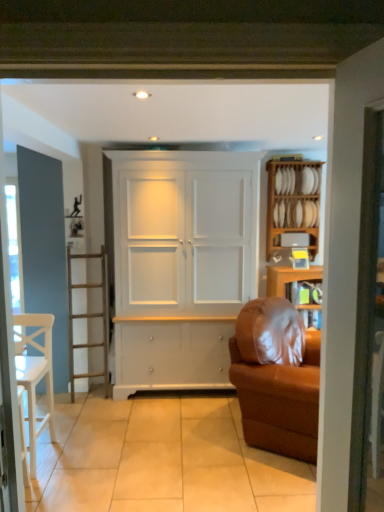
Question: From the image's perspective, is white matte cabinet at center on top of wooden plate rack at right, which is the second shelf from bottom to top?

Choices:
 (A) no
 (B) yes

Answer: (A)

Question: Is white matte cabinet at center next to wooden plate rack at right, which is the second shelf from bottom to top?

Choices:
 (A) yes
 (B) no

Answer: (B)

Question: Is the position of white matte cabinet at center less distant than that of wooden plate rack at right, which is the second shelf from bottom to top?

Choices:
 (A) yes
 (B) no

Answer: (A)

Question: Is white matte cabinet at center shorter than wooden plate rack at right, which is the second shelf from bottom to top?

Choices:
 (A) no
 (B) yes

Answer: (A)

Question: Considering the relative sizes of white matte cabinet at center and wooden plate rack at right, which is the 1th shelf from top to bottom, in the image provided, is white matte cabinet at center bigger than wooden plate rack at right, which is the 1th shelf from top to bottom,?

Choices:
 (A) no
 (B) yes

Answer: (B)

Question: Considering the positions of white wooden shelf at upper right, the first shelf when ordered from bottom to top, and brown fabric couch at right in the image, is white wooden shelf at upper right, the first shelf when ordered from bottom to top, wider or thinner than brown fabric couch at right?

Choices:
 (A) thin
 (B) wide

Answer: (A)

Question: In the image, is white wooden shelf at upper right, the first shelf when ordered from bottom to top, on the left side or the right side of brown fabric couch at right?

Choices:
 (A) left
 (B) right

Answer: (B)

Question: Do you think white wooden shelf at upper right, the first shelf when ordered from bottom to top, is within brown fabric couch at right, or outside of it?

Choices:
 (A) inside
 (B) outside

Answer: (B)

Question: Is point (289, 240) closer or farther from the camera than point (268, 393)?

Choices:
 (A) farther
 (B) closer

Answer: (A)

Question: From a real-world perspective, relative to white wooden shelf at upper right, the first shelf when ordered from bottom to top, is white matte cabinet at center vertically above or below?

Choices:
 (A) below
 (B) above

Answer: (A)

Question: Is point (178, 338) positioned closer to the camera than point (299, 241)?

Choices:
 (A) farther
 (B) closer

Answer: (B)

Question: Which is correct: white matte cabinet at center is inside white wooden shelf at upper right, the first shelf when ordered from bottom to top, or outside of it?

Choices:
 (A) outside
 (B) inside

Answer: (A)

Question: Considering the positions of white matte cabinet at center and white wooden shelf at upper right, the first shelf when ordered from bottom to top, in the image, is white matte cabinet at center taller or shorter than white wooden shelf at upper right, the first shelf when ordered from bottom to top,?

Choices:
 (A) tall
 (B) short

Answer: (A)

Question: From a real-world perspective, is white matte cabinet at center positioned above or below wooden plate rack at right, which is the second shelf from bottom to top?

Choices:
 (A) above
 (B) below

Answer: (B)

Question: Which is correct: white matte cabinet at center is inside wooden plate rack at right, which is the second shelf from bottom to top, or outside of it?

Choices:
 (A) outside
 (B) inside

Answer: (A)